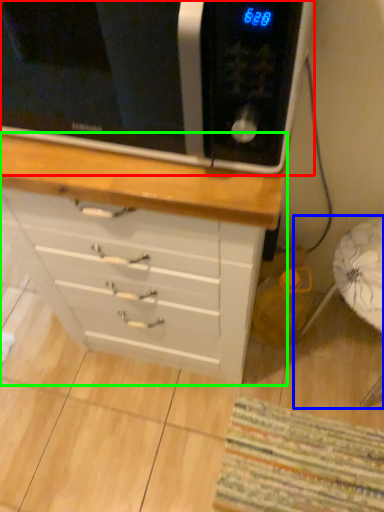
Question: Considering the real-world distances, which object is farthest from microwave oven (highlighted by a red box)? swivel chair (highlighted by a blue box) or chest of drawers (highlighted by a green box)?

Choices:
 (A) swivel chair
 (B) chest of drawers

Answer: (A)